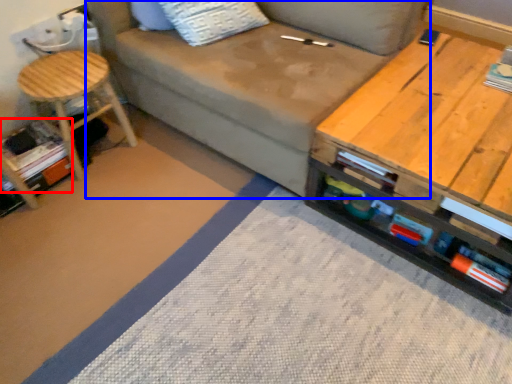
Question: Which object appears farthest to the camera in this image, book (highlighted by a red box) or studio couch (highlighted by a blue box)?

Choices:
 (A) book
 (B) studio couch

Answer: (A)